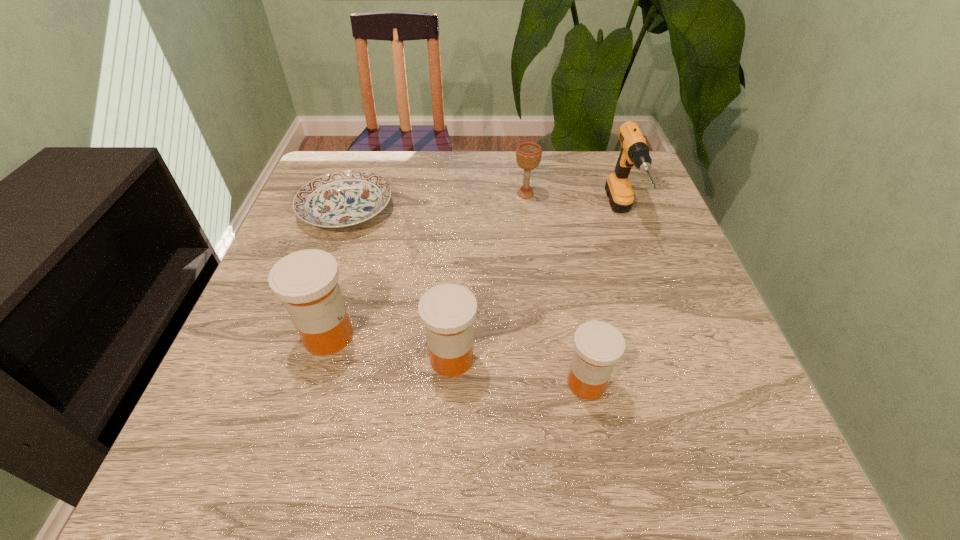
Identify the location of the leftmost medicine. (306, 281).

Locate an element on the screen. The height and width of the screenshot is (540, 960). the second medicine from right to left is located at coordinates (447, 311).

Identify the location of the second shortest medicine. (447, 311).

Where is `the shortest medicine`? the shortest medicine is located at coordinates (598, 345).

You are a GUI agent. You are given a task and a screenshot of the screen. Output one action in this format:
    pyautogui.click(x=<x>, y=<y>)
    Task: Click on the chalice
    The width and height of the screenshot is (960, 540).
    Given the screenshot: What is the action you would take?
    coord(528,154)

Identify the location of plate. The width and height of the screenshot is (960, 540). 343,198.

Identify the location of the rightmost object. This screenshot has width=960, height=540. (634, 151).

I want to click on blank space located on the label of the second medicine from left to right, so click(x=612, y=358).

I want to click on free spot located 0.130m on the left of the chalice, so click(x=465, y=194).

You are a GUI agent. You are given a task and a screenshot of the screen. Output one action in this format:
    pyautogui.click(x=<x>, y=<y>)
    Task: Click on the vacant space located on the front of the shortest object
    The height and width of the screenshot is (540, 960).
    Given the screenshot: What is the action you would take?
    pyautogui.click(x=307, y=325)